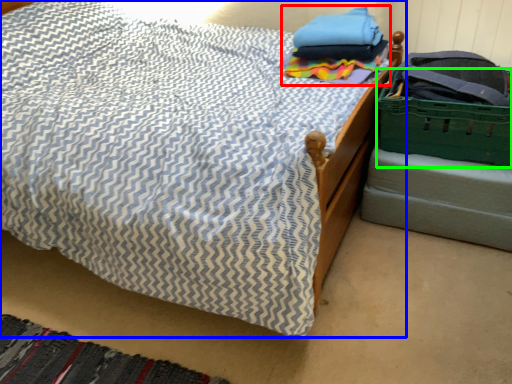
Question: Based on their relative distances, which object is farther from clothing (highlighted by a red box)? Choose from bed (highlighted by a blue box) and basket (highlighted by a green box).

Choices:
 (A) bed
 (B) basket

Answer: (A)